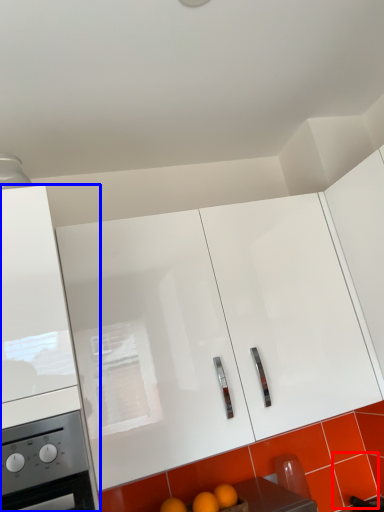
Question: Which object appears farthest to the camera in this image, tile (highlighted by a red box) or cabinetry (highlighted by a blue box)?

Choices:
 (A) tile
 (B) cabinetry

Answer: (A)